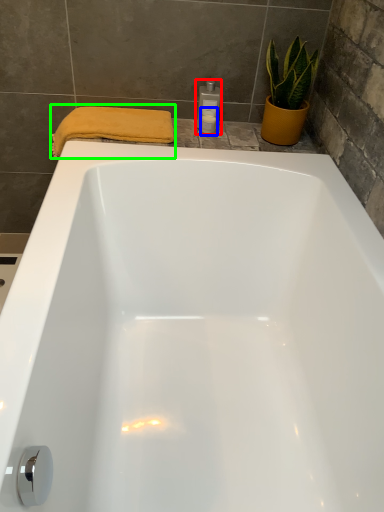
Question: Estimate the real-world distances between objects in this image. Which object is closer to toiletry (highlighted by a red box), toiletry (highlighted by a blue box) or bath towel (highlighted by a green box)?

Choices:
 (A) toiletry
 (B) bath towel

Answer: (A)